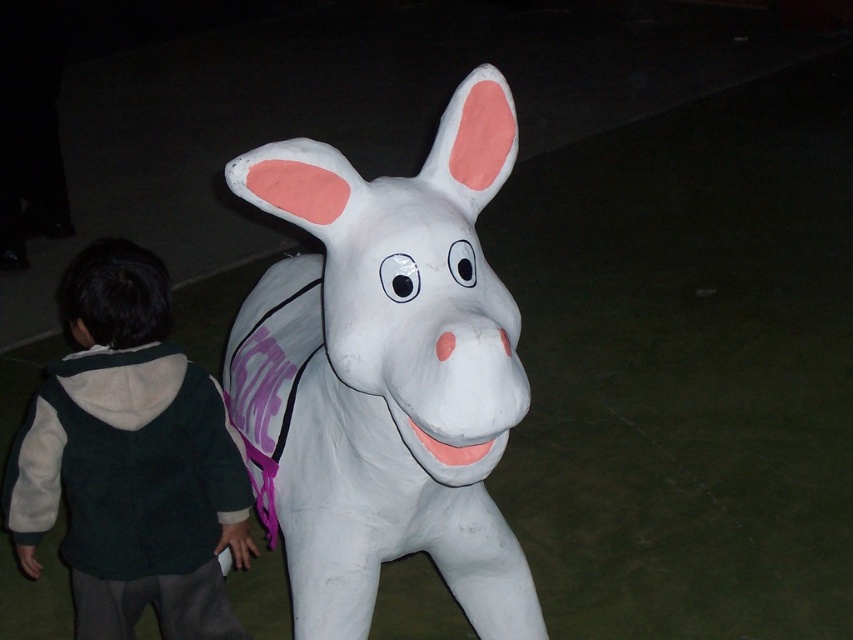
How much distance is there between white matte donkey at center and dark green fleece jacket at lower left?

white matte donkey at center and dark green fleece jacket at lower left are 14.81 inches apart.

Between point (397, 496) and point (103, 397), which one is positioned in front?

Point (397, 496) is more forward.

Find the location of a particular element. The height and width of the screenshot is (640, 853). white matte donkey at center is located at coordinates (386, 372).

Locate an element on the screen. The width and height of the screenshot is (853, 640). white matte donkey at center is located at coordinates (386, 372).